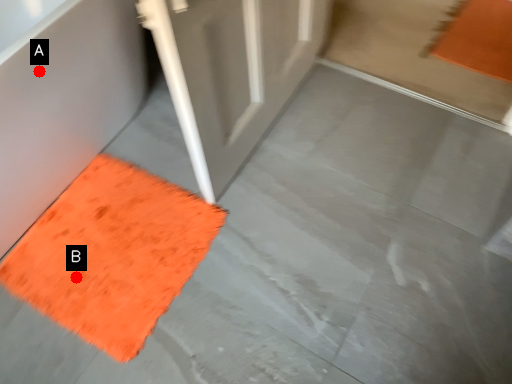
Question: Two points are circled on the image, labeled by A and B beside each circle. Among these points, which one is farthest from the camera?

Choices:
 (A) A is further
 (B) B is further

Answer: (B)